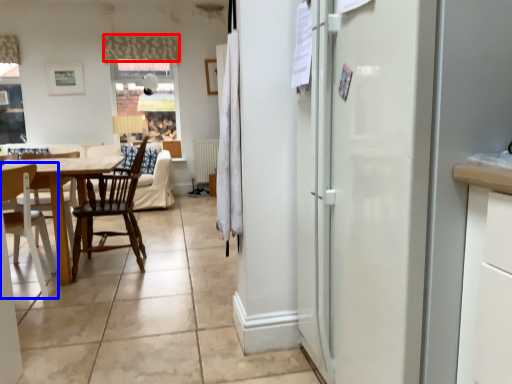
Question: Which object is closer to the camera taking this photo, curtain (highlighted by a red box) or chair (highlighted by a blue box)?

Choices:
 (A) curtain
 (B) chair

Answer: (B)